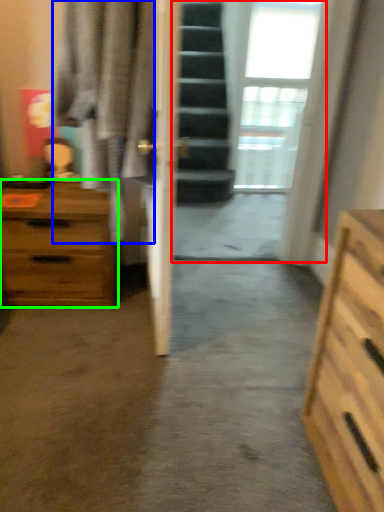
Question: Which is farther away from glass door (highlighted by a red box)? robe (highlighted by a blue box) or chest of drawers (highlighted by a green box)?

Choices:
 (A) robe
 (B) chest of drawers

Answer: (A)